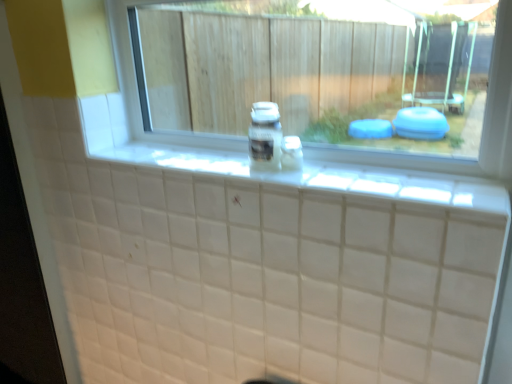
At what (x,y) coordinates should I click in order to perform the action: click on vacant region in front of clear plastic bottle at center. Please return your answer as a coordinate pair (x, y). Image resolution: width=512 pixels, height=384 pixels. Looking at the image, I should click on (277, 175).